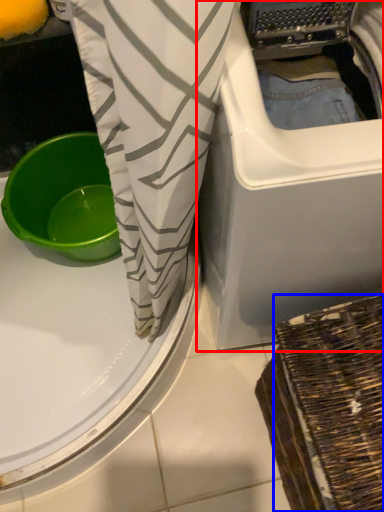
Question: Which of the following is the farthest to the observer, washing machine (highlighted by a red box) or basket (highlighted by a blue box)?

Choices:
 (A) washing machine
 (B) basket

Answer: (B)